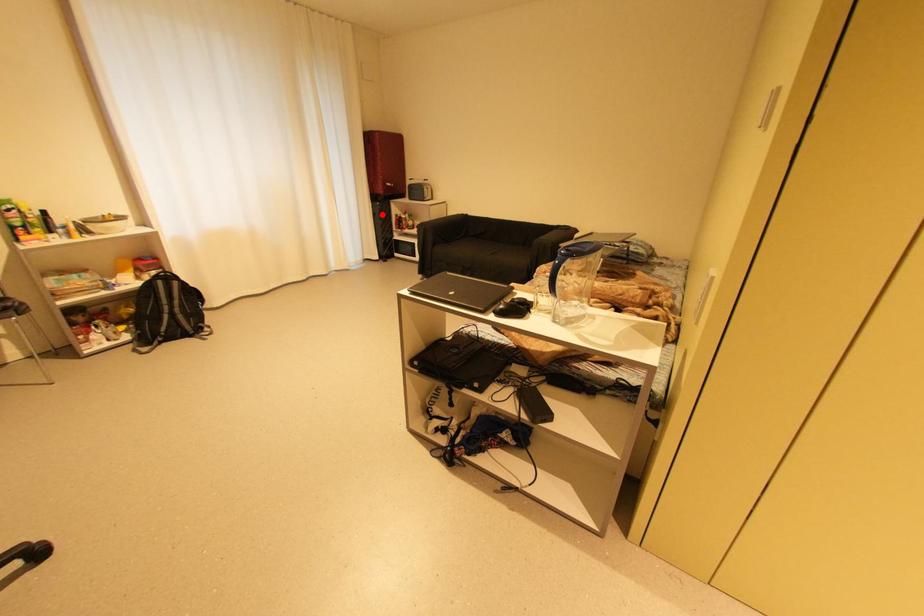
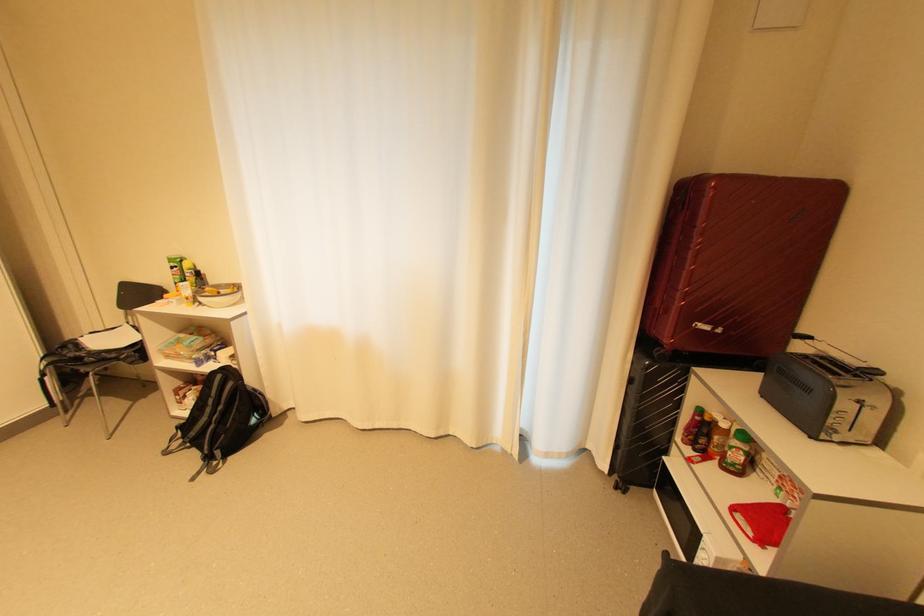
Find the pixel in the second image that matches the highlighted location in the first image.

(638, 381)